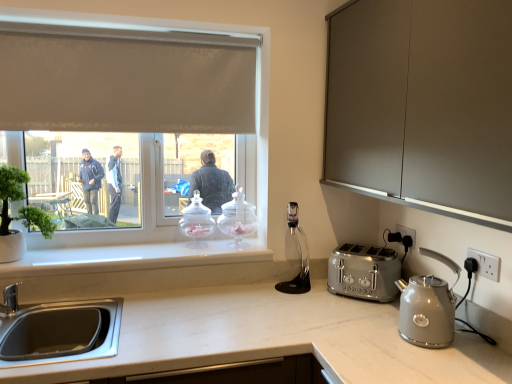
Image resolution: width=512 pixels, height=384 pixels. Identify the location of free location to the right of green matte plant at left. pyautogui.click(x=84, y=252).